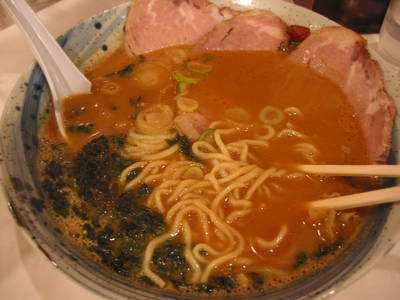
Identify the location of dark dots on bowl. The height and width of the screenshot is (300, 400). (104, 47), (97, 26), (38, 87), (36, 98), (33, 117), (36, 204), (18, 185), (19, 109).